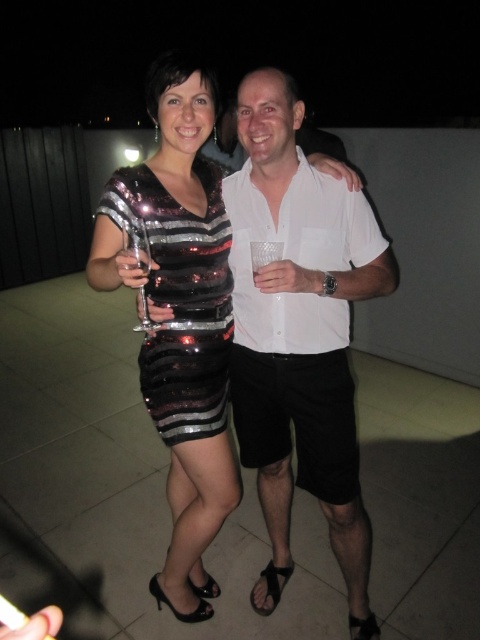
Can you confirm if sparkly sequined dress at center is positioned to the right of sequined black dress at center?

Incorrect, sparkly sequined dress at center is not on the right side of sequined black dress at center.

Which is in front, point (171, 234) or point (223, 298)?

Point (171, 234) is in front.

Between point (151, 289) and point (226, 378), which one is positioned in front?

Point (151, 289) is more forward.

Where is `sparkly sequined dress at center`? sparkly sequined dress at center is located at coordinates (183, 317).

Is point (180, 424) positioned in front of point (137, 250)?

No.

Is sequined black dress at center to the right of clear glass wine glass at center from the viewer's perspective?

Yes, sequined black dress at center is to the right of clear glass wine glass at center.

Between point (165, 384) and point (139, 227), which one is positioned in front?

Positioned in front is point (139, 227).

This screenshot has width=480, height=640. What are the coordinates of `sequined black dress at center` in the screenshot? It's located at (180, 298).

Can you confirm if sparkly sequined dress at center is positioned above clear glass wine glass at center?

No.

Measure the distance between sparkly sequined dress at center and camera.

sparkly sequined dress at center is 3.77 feet away from camera.

Locate an element on the screen. This screenshot has height=640, width=480. sparkly sequined dress at center is located at coordinates (183, 317).